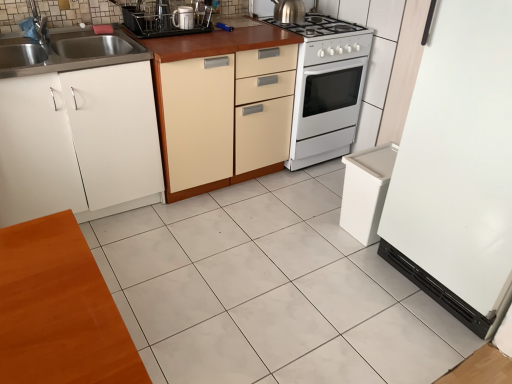
Question: Is polished stainless steel kettle at upper center, arranged as the second kitchen appliance when viewed from the front, surrounding white matte cabinet at left, which is the 2th cabinetry from right to left?

Choices:
 (A) yes
 (B) no

Answer: (B)

Question: Is polished stainless steel kettle at upper center, arranged as the 1th kitchen appliance when viewed from the right, further to camera compared to white matte cabinet at left, which is the 1th cabinetry in left-to-right order?

Choices:
 (A) yes
 (B) no

Answer: (A)

Question: Is the depth of polished stainless steel kettle at upper center, arranged as the 2th kitchen appliance when ordered from the bottom, less than that of white matte cabinet at left, which is the 2th cabinetry from right to left?

Choices:
 (A) no
 (B) yes

Answer: (A)

Question: Does polished stainless steel kettle at upper center, arranged as the second kitchen appliance when viewed from the front, have a larger size compared to white matte cabinet at left, which is the 2th cabinetry from right to left?

Choices:
 (A) yes
 (B) no

Answer: (B)

Question: From a real-world perspective, is polished stainless steel kettle at upper center, acting as the second kitchen appliance starting from the left, over white matte cabinet at left, which is the 2th cabinetry from right to left?

Choices:
 (A) no
 (B) yes

Answer: (B)

Question: Is beige wood cabinet at center, which is the 1th cabinetry in right-to-left order, inside the boundaries of white glossy stove at center, or outside?

Choices:
 (A) inside
 (B) outside

Answer: (B)

Question: From the image's perspective, is beige wood cabinet at center, which is the 1th cabinetry in right-to-left order, positioned above or below white glossy stove at center?

Choices:
 (A) below
 (B) above

Answer: (A)

Question: Is beige wood cabinet at center, which is the 1th cabinetry in right-to-left order, to the left or to the right of white glossy stove at center in the image?

Choices:
 (A) right
 (B) left

Answer: (B)

Question: From a real-world perspective, is beige wood cabinet at center, which is the 1th cabinetry in right-to-left order, physically located above or below white glossy stove at center?

Choices:
 (A) above
 (B) below

Answer: (A)

Question: From the image's perspective, is white matte cabinet at left, which is the 2th cabinetry from right to left, located above or below polished stainless steel kettle at upper center, acting as the second kitchen appliance starting from the left?

Choices:
 (A) above
 (B) below

Answer: (B)

Question: Which is correct: white matte cabinet at left, which is the 2th cabinetry from right to left, is inside polished stainless steel kettle at upper center, acting as the second kitchen appliance starting from the left, or outside of it?

Choices:
 (A) outside
 (B) inside

Answer: (A)

Question: From their relative heights in the image, would you say white matte cabinet at left, which is the 2th cabinetry from right to left, is taller or shorter than polished stainless steel kettle at upper center, arranged as the second kitchen appliance when viewed from the front?

Choices:
 (A) tall
 (B) short

Answer: (A)

Question: Is white matte cabinet at left, which is the 1th cabinetry in left-to-right order, wider or thinner than polished stainless steel kettle at upper center, which ranks as the first kitchen appliance in top-to-bottom order?

Choices:
 (A) thin
 (B) wide

Answer: (B)

Question: From the image's perspective, relative to metallic stainless steel dish rack at upper center, acting as the second appliance starting from the right, is white glossy tile at center above or below?

Choices:
 (A) above
 (B) below

Answer: (B)

Question: Choose the correct answer: Is white glossy tile at center inside metallic stainless steel dish rack at upper center, which appears as the second appliance when ordered from the bottom, or outside it?

Choices:
 (A) outside
 (B) inside

Answer: (A)